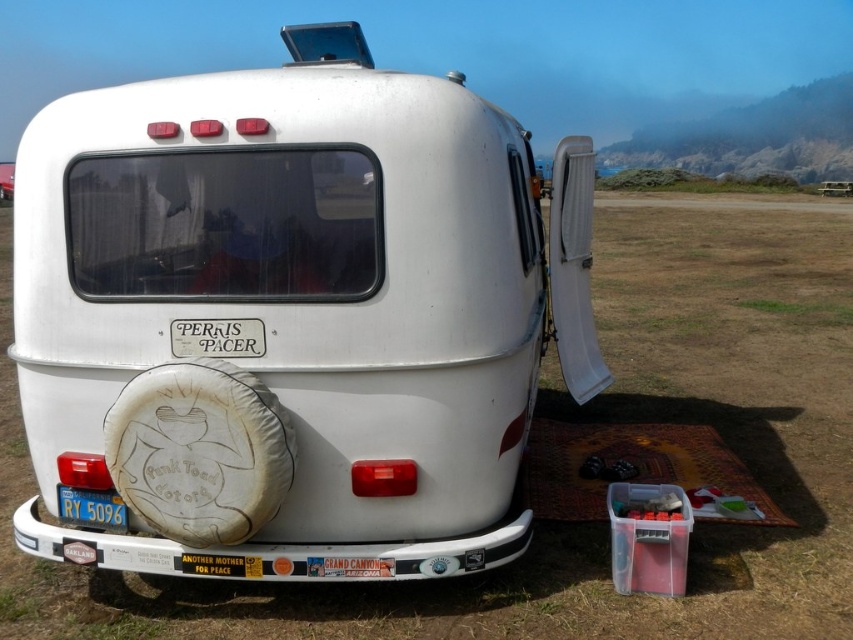
Which is above, white matte recreational vehicle at center or blue metallic license plate at lower left?

Positioned higher is white matte recreational vehicle at center.

This screenshot has height=640, width=853. What are the coordinates of `white matte recreational vehicle at center` in the screenshot? It's located at (292, 317).

You are a GUI agent. You are given a task and a screenshot of the screen. Output one action in this format:
    pyautogui.click(x=<x>, y=<y>)
    Task: Click on the white matte recreational vehicle at center
    The width and height of the screenshot is (853, 640).
    Given the screenshot: What is the action you would take?
    click(x=292, y=317)

Does white fabric tire at rear have a greater height compared to blue metallic license plate at lower left?

Yes.

Measure the distance from white fabric tire at rear to blue metallic license plate at lower left.

white fabric tire at rear and blue metallic license plate at lower left are 19.21 inches apart.

Is point (140, 484) behind point (105, 499)?

No, it is not.

This screenshot has width=853, height=640. In order to click on white fabric tire at rear in this screenshot , I will do `click(199, 451)`.

Based on the photo, is white matte recreational vehicle at center smaller than white fabric tire at rear?

Incorrect, white matte recreational vehicle at center is not smaller in size than white fabric tire at rear.

Who is more forward, (312, 570) or (111, 417)?

Point (111, 417) is more forward.

The height and width of the screenshot is (640, 853). What are the coordinates of `white matte recreational vehicle at center` in the screenshot? It's located at (292, 317).